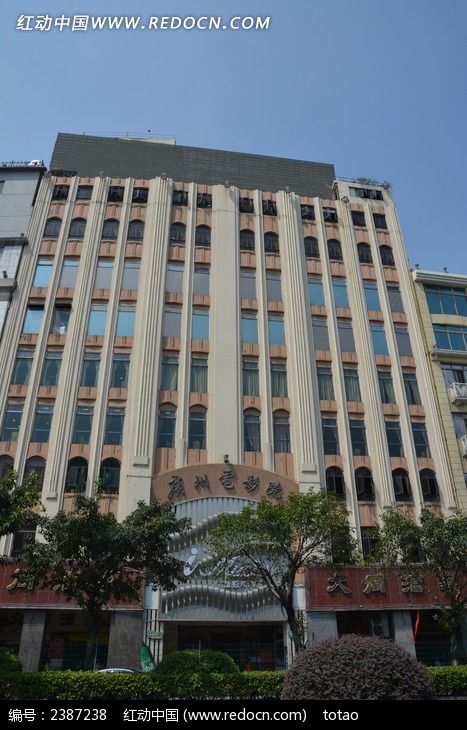
The image size is (467, 730). Find the location of `arched windows`. arched windows is located at coordinates (109, 476), (80, 466), (41, 464), (6, 460), (333, 474), (363, 479), (404, 483), (432, 483).